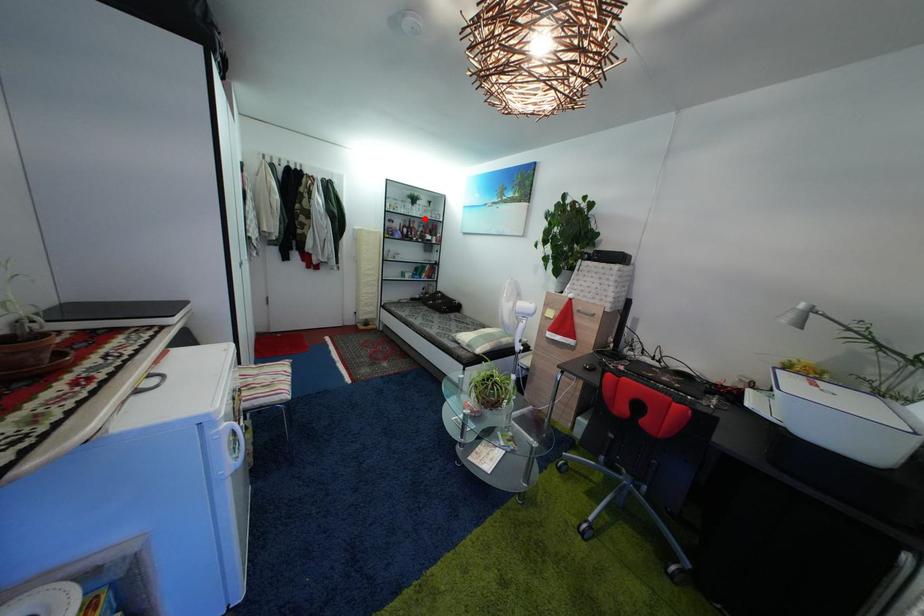
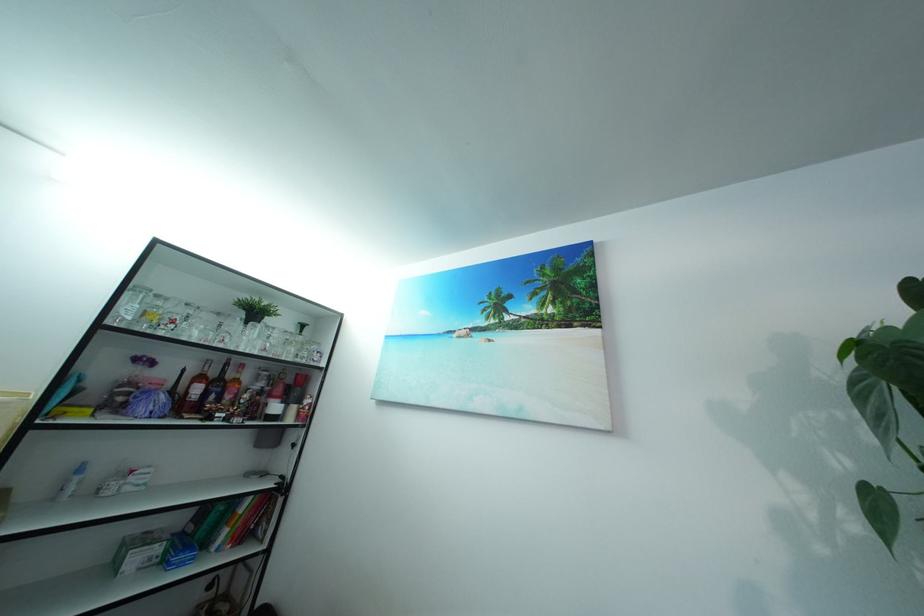
Question: I am providing you with two images of the same scene from different viewpoints. A red point is shown in image1. For the corresponding object point in image2, is it positioned nearer or farther from the camera?

Choices:
 (A) Nearer
 (B) Farther

Answer: (B)